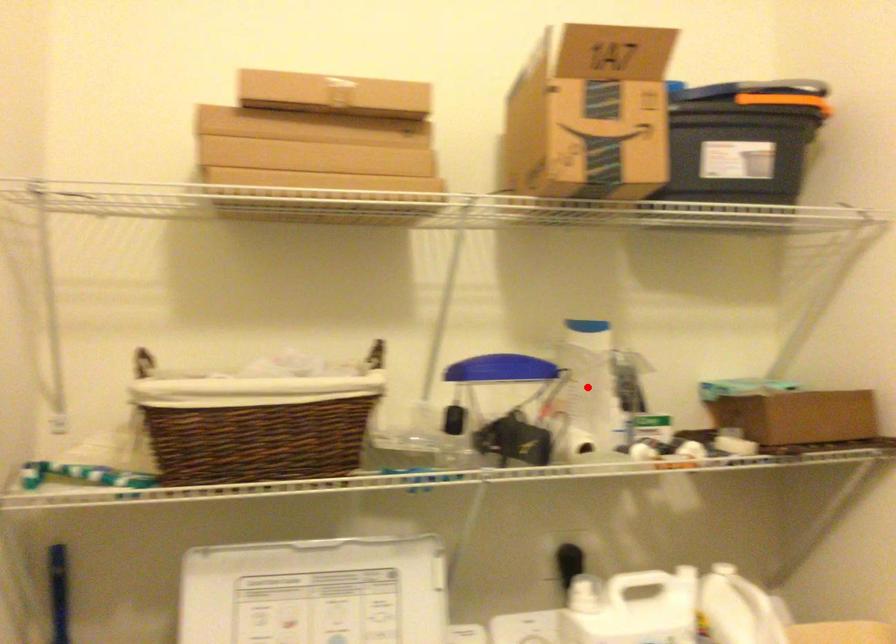
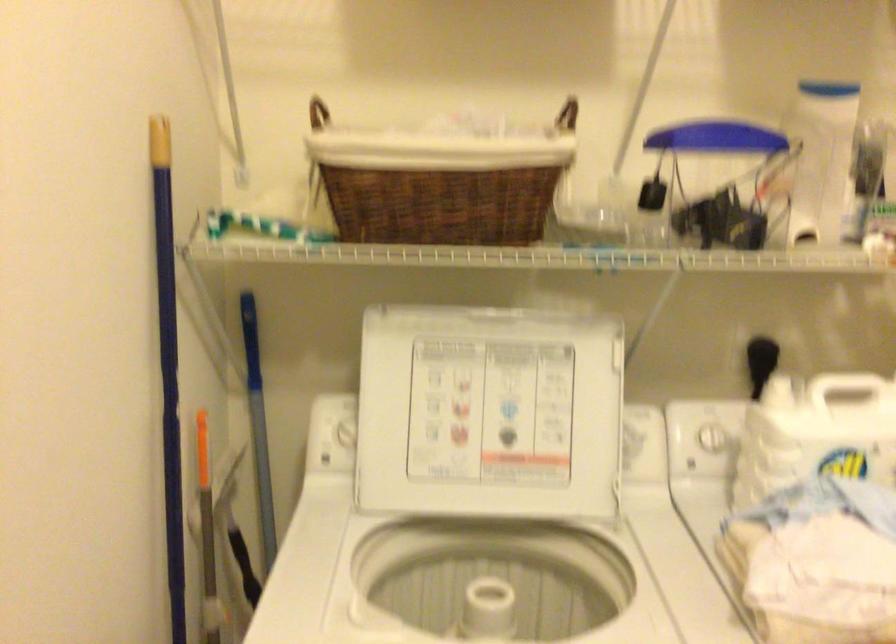
Question: A red point is marked in image1. In image2, is the corresponding 3D point closer to the camera or farther? Reply with the corresponding letter.

Choices:
 (A) The corresponding 3D point is closer.
 (B) The corresponding 3D point is farther.

Answer: (A)